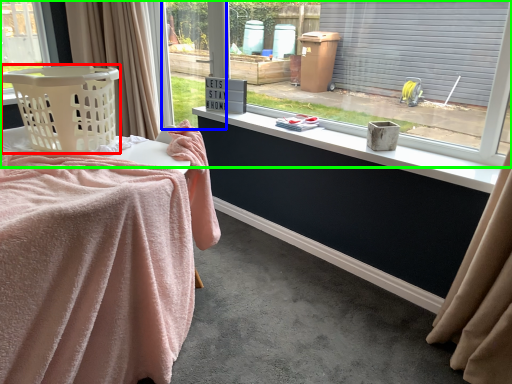
Question: Which is farther away from basket (highlighted by a red box)? window frame (highlighted by a blue box) or window (highlighted by a green box)?

Choices:
 (A) window frame
 (B) window

Answer: (A)